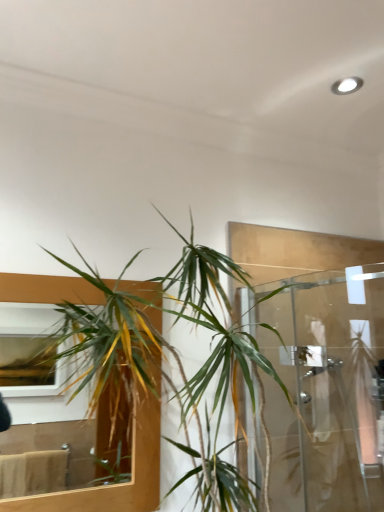
Question: Considering the relative sizes of green leafy plant at center and green leafy plant at left in the image provided, is green leafy plant at center bigger than green leafy plant at left?

Choices:
 (A) yes
 (B) no

Answer: (A)

Question: Would you say green leafy plant at center contains green leafy plant at left?

Choices:
 (A) yes
 (B) no

Answer: (B)

Question: Is green leafy plant at center taller than green leafy plant at left?

Choices:
 (A) yes
 (B) no

Answer: (A)

Question: Can you confirm if green leafy plant at center is smaller than green leafy plant at left?

Choices:
 (A) yes
 (B) no

Answer: (B)

Question: From a real-world perspective, is green leafy plant at center on top of green leafy plant at left?

Choices:
 (A) yes
 (B) no

Answer: (A)

Question: Can you confirm if green leafy plant at center is positioned to the left of green leafy plant at left?

Choices:
 (A) yes
 (B) no

Answer: (B)

Question: Can we say clear glass shower door at right lies outside green leafy plant at left?

Choices:
 (A) yes
 (B) no

Answer: (A)

Question: Is clear glass shower door at right at the left side of green leafy plant at left?

Choices:
 (A) no
 (B) yes

Answer: (A)

Question: Is clear glass shower door at right taller than green leafy plant at left?

Choices:
 (A) yes
 (B) no

Answer: (A)

Question: Is clear glass shower door at right oriented towards green leafy plant at left?

Choices:
 (A) yes
 (B) no

Answer: (A)

Question: Considering the relative sizes of clear glass shower door at right and green leafy plant at left in the image provided, is clear glass shower door at right thinner than green leafy plant at left?

Choices:
 (A) yes
 (B) no

Answer: (B)

Question: Would you consider clear glass shower door at right to be distant from green leafy plant at left?

Choices:
 (A) yes
 (B) no

Answer: (B)

Question: From a real-world perspective, is green leafy plant at left under green leafy plant at center?

Choices:
 (A) yes
 (B) no

Answer: (A)